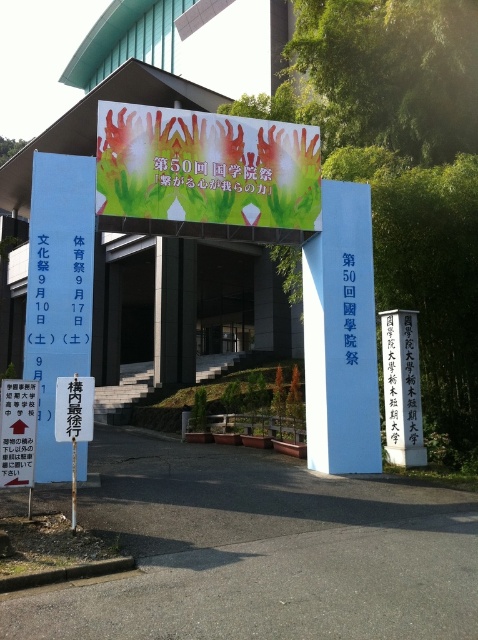
Question: Can you confirm if white stone sign at center is smaller than white paper sign at center?

Choices:
 (A) no
 (B) yes

Answer: (A)

Question: Which point is farther to the camera?

Choices:
 (A) bluetexturedsign at center
 (B) greentextured fabricbanner at upper center
 (C) blue smooth sign at center
 (D) white paper sign at center

Answer: (A)

Question: Which object is closer to the camera taking this photo?

Choices:
 (A) bluetexturedsign at center
 (B) white paper sign at center
 (C) white paper sign at left
 (D) white stone sign at center

Answer: (B)

Question: Which point is closer to the camera taking this photo?

Choices:
 (A) (329, 365)
 (B) (86, 436)
 (C) (221, 168)

Answer: (B)

Question: Does white paper sign at left lie behind white stone sign at center?

Choices:
 (A) no
 (B) yes

Answer: (A)

Question: Is white paper sign at center wider than bluetexturedsign at center?

Choices:
 (A) no
 (B) yes

Answer: (B)